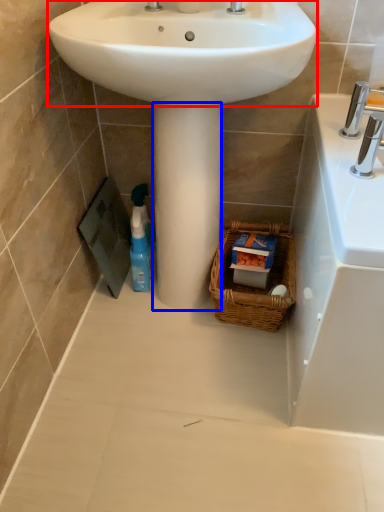
Question: Which object appears closest to the camera in this image, sink (highlighted by a red box) or pillar (highlighted by a blue box)?

Choices:
 (A) sink
 (B) pillar

Answer: (A)